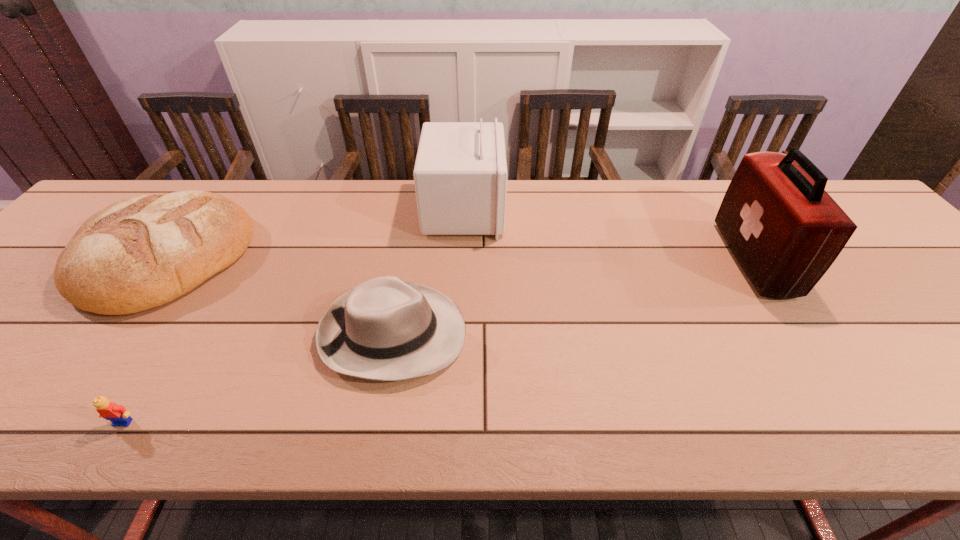
Identify the location of vacant space located on the front of the bread. The image size is (960, 540). (63, 392).

Where is `free location located 0.100m on the front-facing side of the fedora`? Image resolution: width=960 pixels, height=540 pixels. free location located 0.100m on the front-facing side of the fedora is located at coordinates point(512,334).

Identify the location of bread present at the far edge. The image size is (960, 540). (139, 253).

At what (x,y) coordinates should I click in order to perform the action: click on object present at the near edge. Please return your answer as a coordinate pair (x, y). The width and height of the screenshot is (960, 540). Looking at the image, I should click on (117, 414).

Locate an element on the screen. Image resolution: width=960 pixels, height=540 pixels. object that is positioned at the left edge is located at coordinates (139, 253).

Locate an element on the screen. The width and height of the screenshot is (960, 540). object that is at the far left corner is located at coordinates (139, 253).

Identify the location of free space at the far edge of the desktop. (676, 195).

The width and height of the screenshot is (960, 540). I want to click on vacant area at the near edge of the desktop, so click(x=774, y=417).

In the image, there is a desktop. Identify the location of vacant space at the right edge. (907, 287).

At what (x,y) coordinates should I click in order to perform the action: click on free space between the bread and the shortest object. Please return your answer as a coordinate pair (x, y). Looking at the image, I should click on point(144,340).